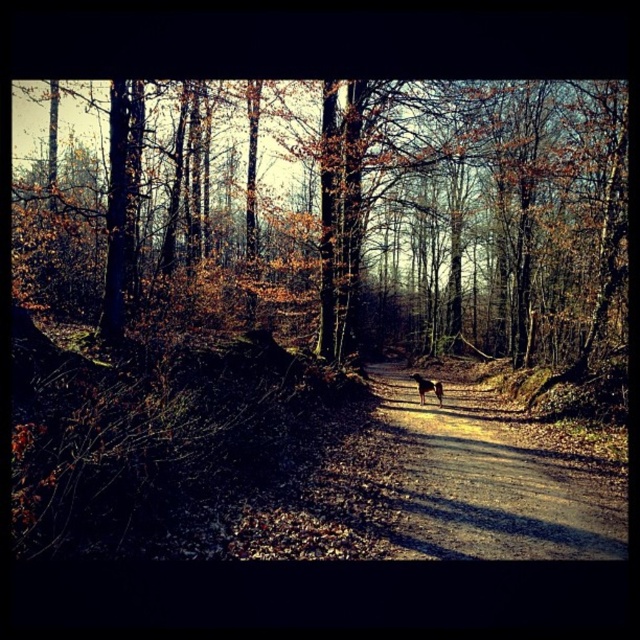
Between brown bark tree at center and brown dirt path at center, which one appears on the left side from the viewer's perspective?

brown bark tree at center is more to the left.

Is point (132, 291) behind point (419, 508)?

Yes.

Identify the location of brown bark tree at center. (394, 209).

Does point (524, 189) lie behind point (417, 384)?

That is True.

Is point (458, 240) in front of point (424, 388)?

That is False.

Is point (449, 115) closer to viewer compared to point (419, 387)?

No, (449, 115) is behind (419, 387).

The width and height of the screenshot is (640, 640). Find the location of `brown bark tree at center`. brown bark tree at center is located at coordinates (394, 209).

Can you confirm if brown dirt path at center is positioned to the left of brown fur dog at center?

In fact, brown dirt path at center is to the right of brown fur dog at center.

Is brown dirt path at center thinner than brown fur dog at center?

No.

Is point (500, 460) in front of point (422, 380)?

That is True.

Find the location of a particular element. The image size is (640, 640). brown dirt path at center is located at coordinates (492, 483).